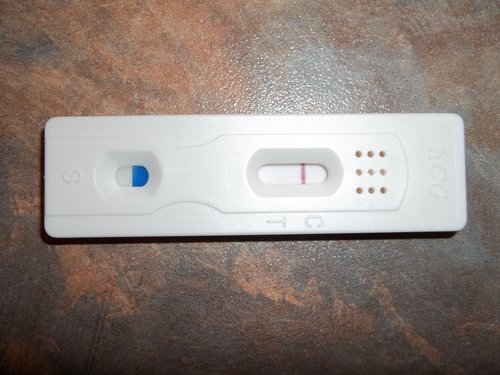
This screenshot has width=500, height=375. I want to click on orange paint, so click(x=188, y=70).